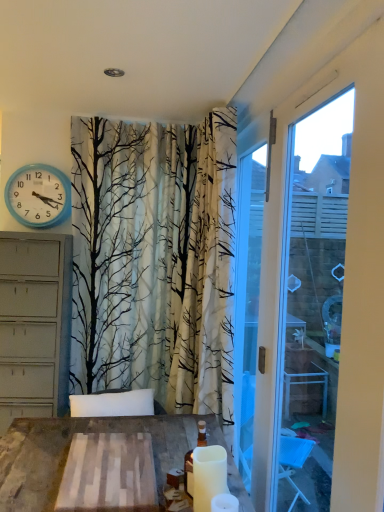
Question: From the image's perspective, is blue plastic wall clock at upper left below white matte candle at lower center, positioned as the second candle in front-to-back order?

Choices:
 (A) no
 (B) yes

Answer: (A)

Question: Can you confirm if blue plastic wall clock at upper left is thinner than white matte candle at lower center, the 1th candle when ordered from back to front?

Choices:
 (A) yes
 (B) no

Answer: (A)

Question: Is blue plastic wall clock at upper left located outside white matte candle at lower center, the 1th candle when ordered from back to front?

Choices:
 (A) yes
 (B) no

Answer: (A)

Question: Does blue plastic wall clock at upper left have a greater height compared to white matte candle at lower center, positioned as the second candle in front-to-back order?

Choices:
 (A) no
 (B) yes

Answer: (B)

Question: Is blue plastic wall clock at upper left beside white matte candle at lower center, the 1th candle when ordered from back to front?

Choices:
 (A) no
 (B) yes

Answer: (A)

Question: In the image, is white matte candle at lower center, the 1th candle when ordered from back to front, on the left side or the right side of white plastic window frame at right?

Choices:
 (A) left
 (B) right

Answer: (A)

Question: Based on their sizes in the image, would you say white matte candle at lower center, the 1th candle when ordered from back to front, is bigger or smaller than white plastic window frame at right?

Choices:
 (A) big
 (B) small

Answer: (B)

Question: From a real-world perspective, relative to white plastic window frame at right, is white matte candle at lower center, the 1th candle when ordered from back to front, vertically above or below?

Choices:
 (A) below
 (B) above

Answer: (A)

Question: From their relative heights in the image, would you say white matte candle at lower center, positioned as the second candle in front-to-back order, is taller or shorter than white plastic window frame at right?

Choices:
 (A) short
 (B) tall

Answer: (A)

Question: Considering their positions, is blue plastic wall clock at upper left located in front of or behind white matte candle at lower center, positioned as the second candle in front-to-back order?

Choices:
 (A) behind
 (B) front

Answer: (A)

Question: Looking at the image, does blue plastic wall clock at upper left seem bigger or smaller compared to white matte candle at lower center, the 1th candle when ordered from back to front?

Choices:
 (A) small
 (B) big

Answer: (B)

Question: Is blue plastic wall clock at upper left taller or shorter than white matte candle at lower center, the 1th candle when ordered from back to front?

Choices:
 (A) short
 (B) tall

Answer: (B)

Question: From the image's perspective, relative to white matte candle at lower center, positioned as the second candle in front-to-back order, is blue plastic wall clock at upper left above or below?

Choices:
 (A) above
 (B) below

Answer: (A)

Question: Choose the correct answer: Is white matte candle at lower right, which ranks as the 2th candle in back-to-front order, inside white matte candle at lower center, positioned as the second candle in front-to-back order, or outside it?

Choices:
 (A) inside
 (B) outside

Answer: (B)

Question: Is point (221, 497) positioned closer to the camera than point (195, 482)?

Choices:
 (A) closer
 (B) farther

Answer: (B)